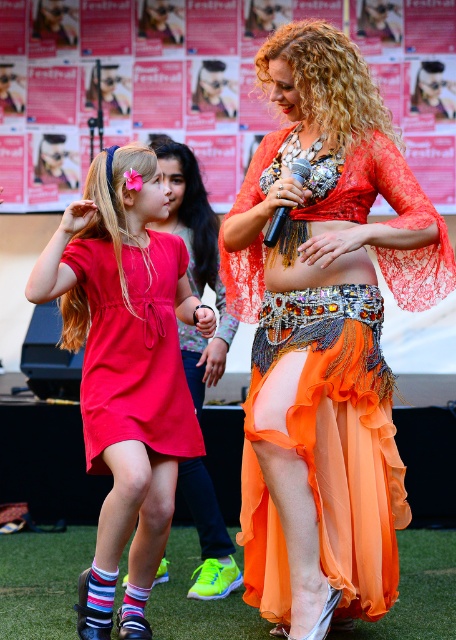
Is point (172, 396) positioned before point (300, 164)?

No, (172, 396) is further to viewer.

The image size is (456, 640). I want to click on matte red dress at left, so click(x=134, y=349).

Between shiny orange fabric at center and orange chiffon dress at center, which one has less height?

orange chiffon dress at center is shorter.

Is shiny orange fabric at center below orange chiffon dress at center?

Yes, shiny orange fabric at center is below orange chiffon dress at center.

The image size is (456, 640). Describe the element at coordinates (325, 337) in the screenshot. I see `shiny orange fabric at center` at that location.

At what (x,y) coordinates should I click in order to perform the action: click on shiny orange fabric at center. Please return your answer as a coordinate pair (x, y). The width and height of the screenshot is (456, 640). Looking at the image, I should click on (325, 337).

The height and width of the screenshot is (640, 456). What do you see at coordinates (125, 369) in the screenshot?
I see `matte red dress at center` at bounding box center [125, 369].

Is point (96, 324) positioned after point (300, 170)?

Yes, it is.

Locate an element on the screen. The image size is (456, 640). matte red dress at center is located at coordinates (125, 369).